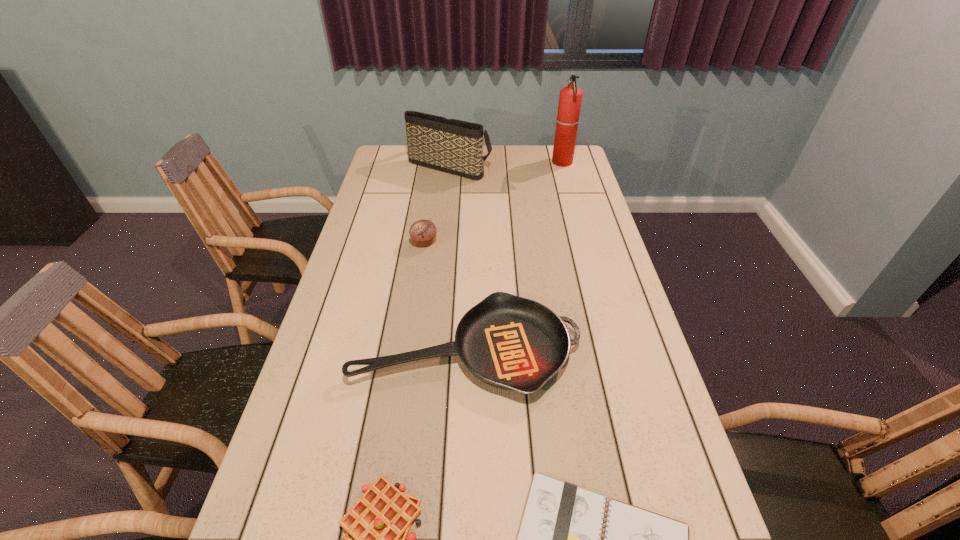
At what (x,y) coordinates should I click in order to perform the action: click on vacant space located 0.320m on the back of the fourth nearest object. Please return your answer as a coordinate pair (x, y). The width and height of the screenshot is (960, 540). Looking at the image, I should click on (433, 184).

Where is `vacant space located on the right of the frying pan`? vacant space located on the right of the frying pan is located at coordinates [629, 349].

Find the location of a particular element. fire extinguisher that is at the far edge is located at coordinates (570, 98).

At what (x,y) coordinates should I click in order to perform the action: click on handbag situated at the far edge. Please return your answer as a coordinate pair (x, y). Image resolution: width=960 pixels, height=540 pixels. Looking at the image, I should click on (454, 146).

Identify the location of handbag situated at the left edge. This screenshot has width=960, height=540. (454, 146).

Where is `frying pan situated at the left edge`? This screenshot has height=540, width=960. frying pan situated at the left edge is located at coordinates [x=509, y=342].

Identify the location of object located at the right edge. (570, 98).

The width and height of the screenshot is (960, 540). I want to click on object located at the far left corner, so click(454, 146).

Locate an element on the screen. object that is positioned at the far right corner is located at coordinates (570, 98).

Find the location of `free spot at the left edge of the desktop`. free spot at the left edge of the desktop is located at coordinates 322,359.